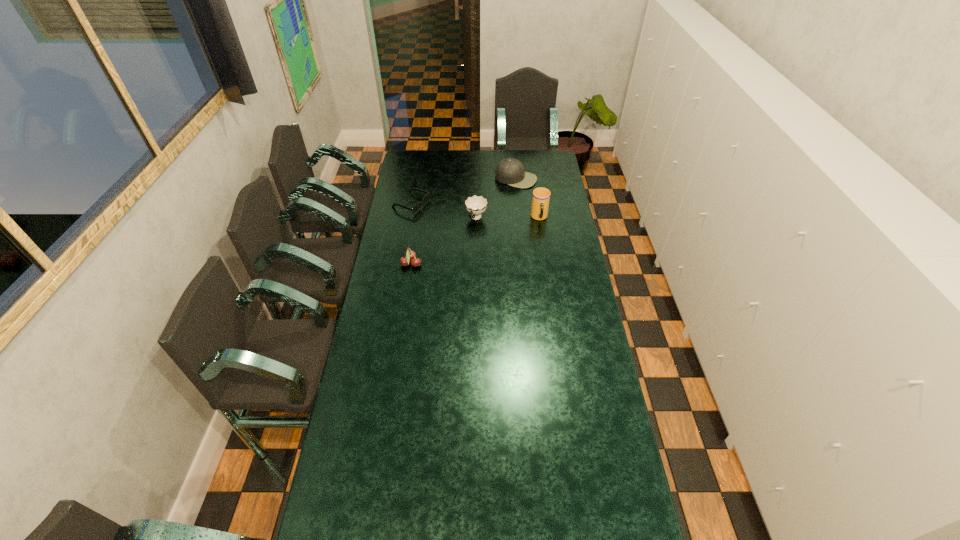
Where is `free space between the cherry and the shortest object`? free space between the cherry and the shortest object is located at coordinates (412, 234).

Identify the location of vacant space that's between the cherry and the sunglasses. pyautogui.click(x=412, y=234).

Find the location of a particular element. This screenshot has height=540, width=960. unoccupied position between the nearest object and the cap is located at coordinates (464, 221).

I want to click on unoccupied position between the nearest object and the farthest object, so click(x=464, y=221).

Find the location of `empty space that is in between the sunglasses and the nearest object`. empty space that is in between the sunglasses and the nearest object is located at coordinates (412, 234).

Identify the location of free point between the farthest object and the shortest object. This screenshot has width=960, height=540. (464, 192).

At what (x,y) coordinates should I click in order to perform the action: click on unoccupied position between the third object from left to right and the cherry. Please return your answer as a coordinate pair (x, y). The image size is (960, 540). Looking at the image, I should click on (444, 241).

At what (x,y) coordinates should I click in order to perform the action: click on free area in between the third object from left to right and the sunglasses. Please return your answer as a coordinate pair (x, y). Looking at the image, I should click on (444, 211).

Identify which object is the third closest to the nearest object. Please provide its 2D coordinates. Your answer should be formatted as a tuple, i.e. [(x, y)], where the tuple contains the x and y coordinates of a point satisfying the conditions above.

[(541, 196)]

Identify the location of object that ranks as the second closest to the cap. (475, 205).